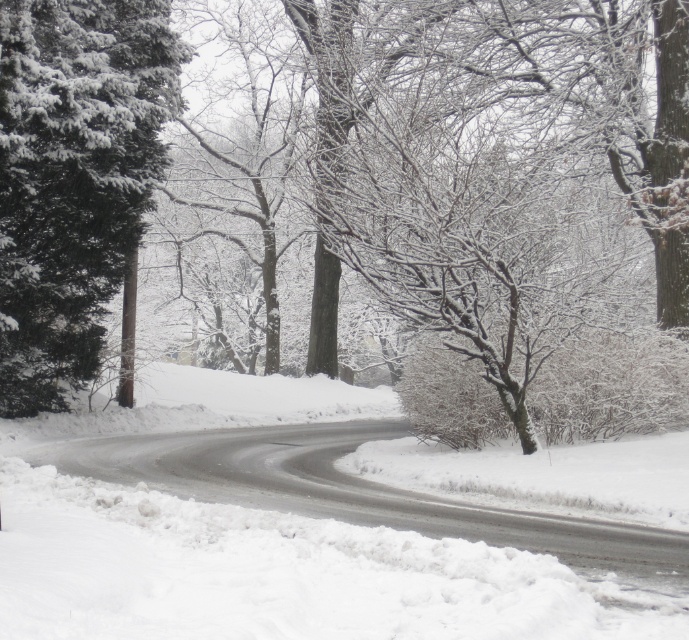
Question: Does white fluffy snow at center appear over green matte evergreen tree at left?

Choices:
 (A) yes
 (B) no

Answer: (B)

Question: Which point is farther from the camera taking this photo?

Choices:
 (A) (6, 16)
 (B) (141, 396)

Answer: (B)

Question: Is white fluffy snow at center thinner than green matte evergreen tree at left?

Choices:
 (A) no
 (B) yes

Answer: (A)

Question: Which object is closer to the camera taking this photo?

Choices:
 (A) green matte evergreen tree at left
 (B) white fluffy snow at center

Answer: (B)

Question: Is white fluffy snow at center closer to the viewer compared to green matte evergreen tree at left?

Choices:
 (A) yes
 (B) no

Answer: (A)

Question: Which of the following is the farthest from the observer?

Choices:
 (A) white fluffy snow at center
 (B) green matte evergreen tree at left

Answer: (B)